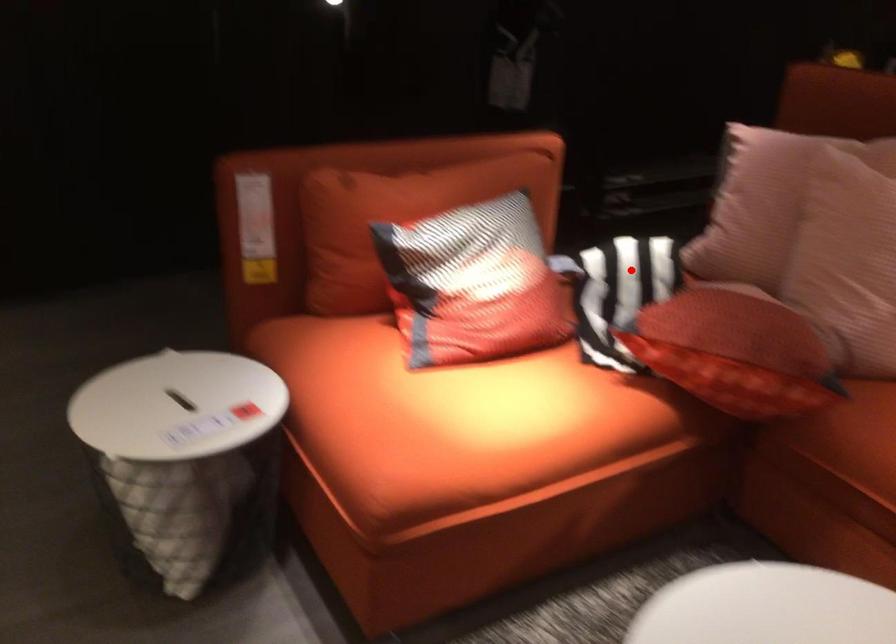
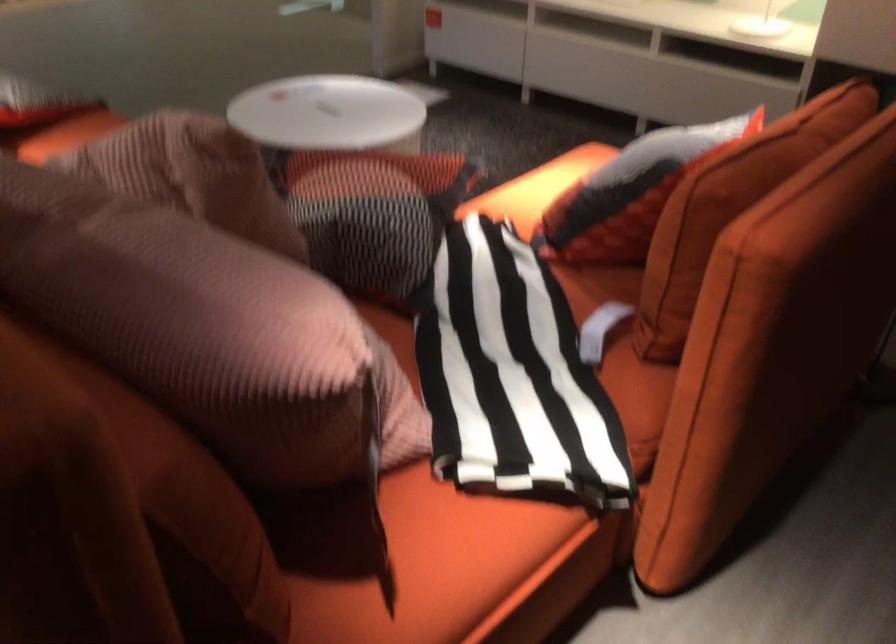
Question: I am providing you with two images of the same scene from different viewpoints. In image1, a red point is highlighted. Considering the same 3D point in image2, which of the following is correct?

Choices:
 (A) It is closer
 (B) It is farther

Answer: (A)